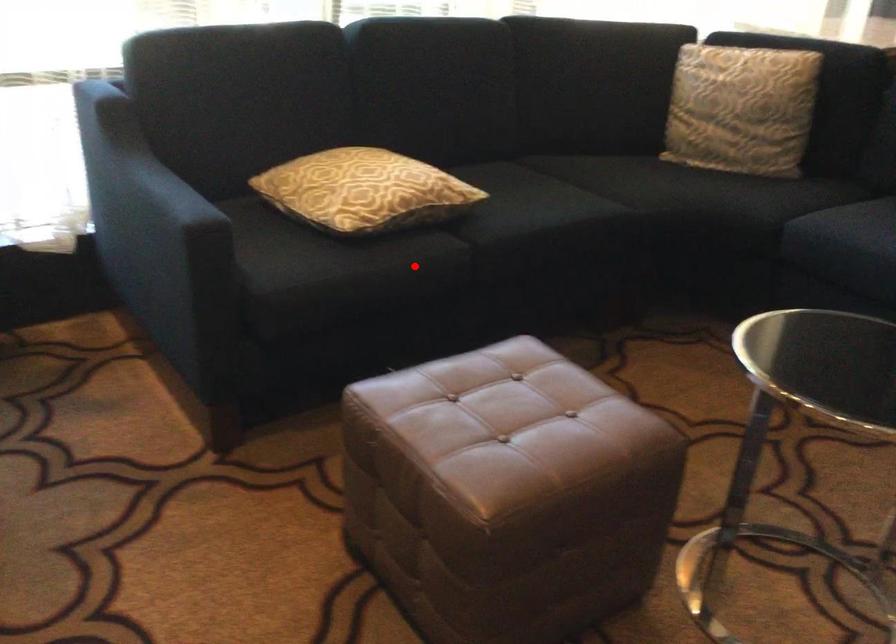
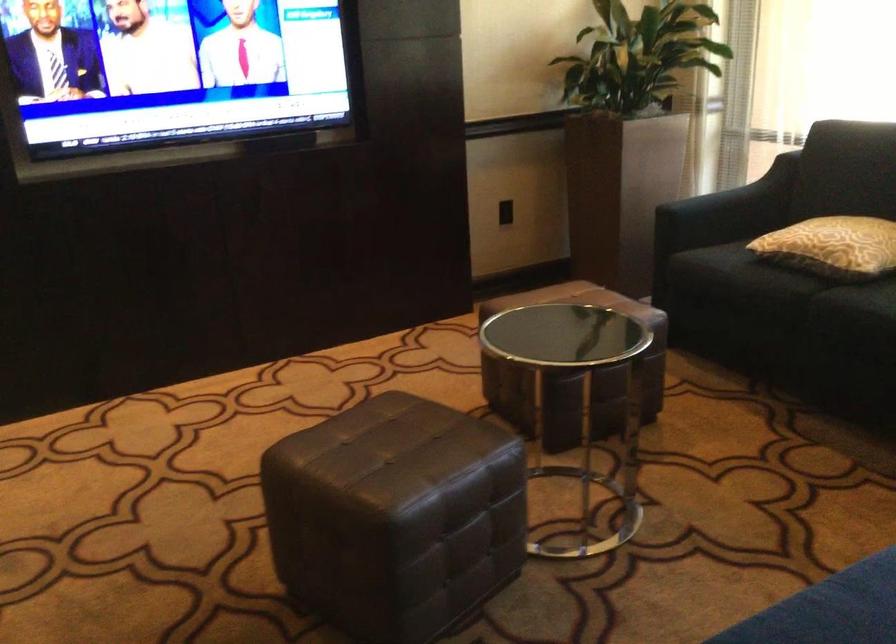
Question: I am providing you with two images of the same scene from different viewpoints. Given a red point in image1, look at the same physical point in image2. Is it:

Choices:
 (A) Closer to the viewpoint
 (B) Farther from the viewpoint

Answer: (B)